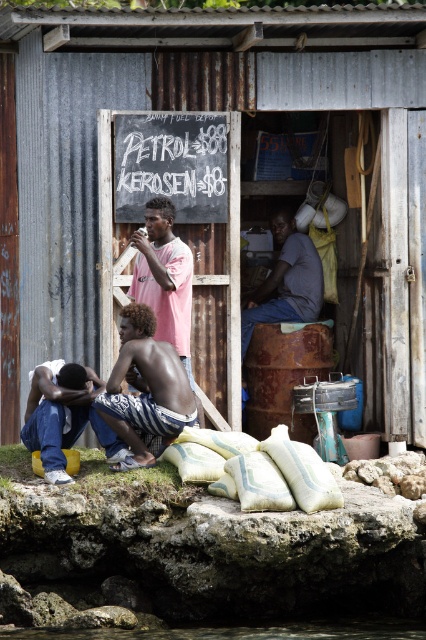
Who is shorter, rusty metal barrel at center or dark skin textured torso at lower center?

Standing shorter between the two is dark skin textured torso at lower center.

The width and height of the screenshot is (426, 640). Describe the element at coordinates (227, 173) in the screenshot. I see `rusty metal barrel at center` at that location.

You are a GUI agent. You are given a task and a screenshot of the screen. Output one action in this format:
    pyautogui.click(x=<x>, y=<y>)
    Task: Click on the rusty metal barrel at center
    
    Given the screenshot: What is the action you would take?
    pyautogui.click(x=227, y=173)

Does pink cotton t-shirt at center appear on the left side of clear water at lower center?

Indeed, pink cotton t-shirt at center is positioned on the left side of clear water at lower center.

Is pink cotton t-shirt at center taller than clear water at lower center?

Correct, pink cotton t-shirt at center is much taller as clear water at lower center.

Is point (183, 252) positioned before point (271, 625)?

No, (183, 252) is behind (271, 625).

Image resolution: width=426 pixels, height=640 pixels. In order to click on pink cotton t-shirt at center in this screenshot , I will do `click(164, 276)`.

Who is positioned more to the left, clear water at lower center or denim jeans at lower left?

From the viewer's perspective, denim jeans at lower left appears more on the left side.

You are a GUI agent. You are given a task and a screenshot of the screen. Output one action in this format:
    pyautogui.click(x=<x>, y=<y>)
    Task: Click on the clear water at lower center
    
    Given the screenshot: What is the action you would take?
    pyautogui.click(x=241, y=630)